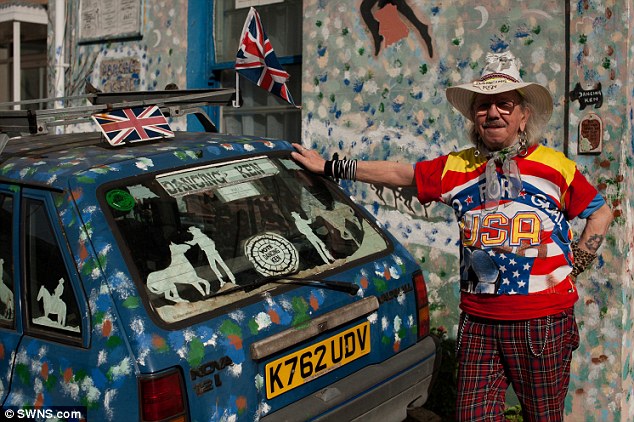
Locate an element on the screen. sticker is located at coordinates (274, 243).